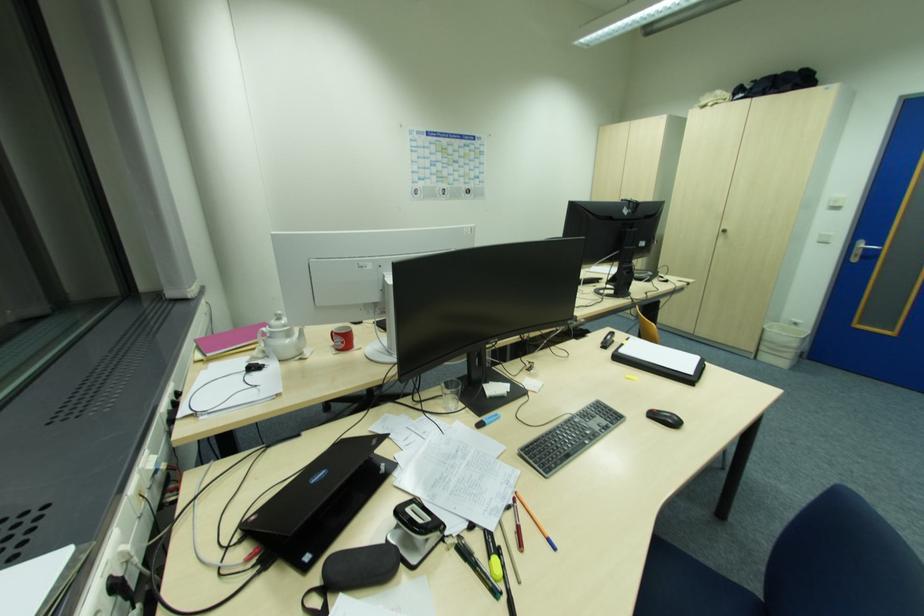
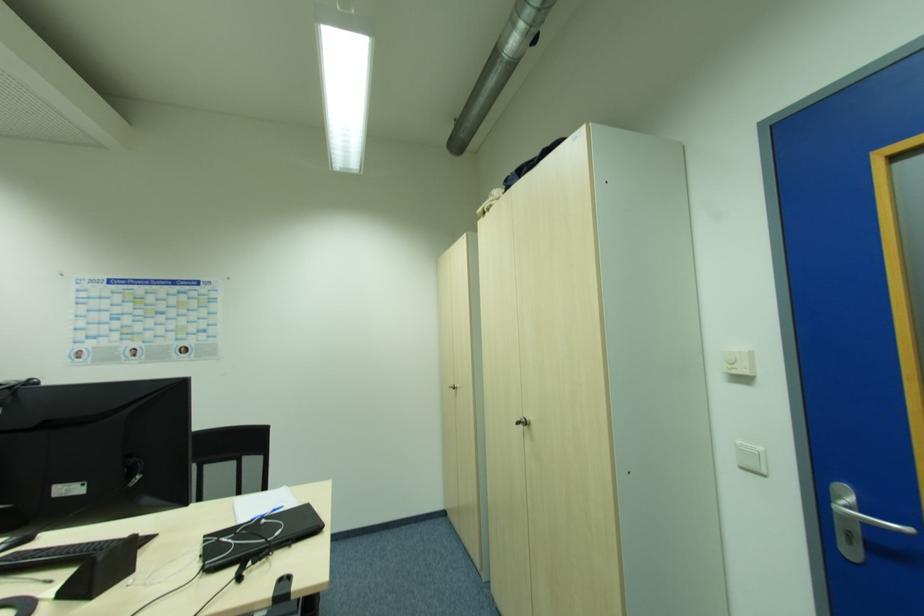
In the second image, find the point that corresponds to (821,243) in the first image.

(746, 469)